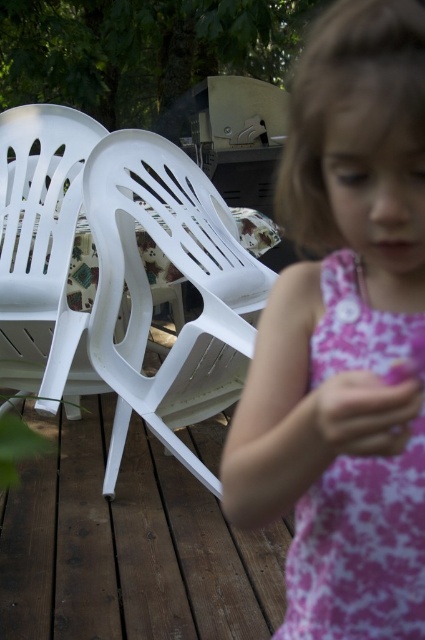
You are a photographer setting up for a family portrait in the backyard. You notice the pink floral dress at right and the white plastic chair at left. Where should you place the spotlight to ensure both objects are well lit?

The pink floral dress at right is positioned under the white plastic chair at left, so placing the spotlight above the white plastic chair at left would illuminate both the dress and the chair effectively.

You are a photographer setting up a shot of the young girl in the pink floral dress at center and the white plastic chair at left. You need to ensure that the dress is not taller than the chair in the photo. Based on the scene, will this arrangement work?

The pink floral dress at center has a lesser height compared to the white plastic chair at left, so the arrangement will work as the dress is shorter than the chair.